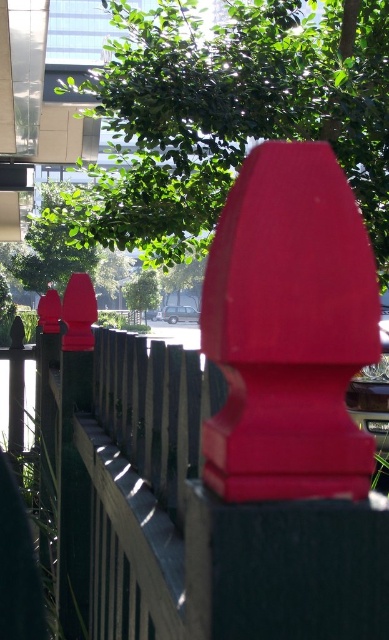
Can you confirm if green leafy tree at upper center is positioned to the left of matte plastic fence post at center?

In fact, green leafy tree at upper center is to the right of matte plastic fence post at center.

Does green leafy tree at upper center lie behind matte plastic fence post at center?

Yes.

Which is behind, point (264, 131) or point (262, 344)?

The point (264, 131) is behind.

Identify the location of green leafy tree at upper center. The image size is (389, 640). (229, 115).

At what (x,y) coordinates should I click in order to perform the action: click on matte wood fence at center. Please return your answer as a coordinate pair (x, y). Looking at the image, I should click on (173, 509).

What do you see at coordinates (173, 509) in the screenshot? I see `matte wood fence at center` at bounding box center [173, 509].

Describe the element at coordinates (173, 509) in the screenshot. I see `matte wood fence at center` at that location.

The height and width of the screenshot is (640, 389). Identify the location of matte wood fence at center. (173, 509).

Which is more to the left, matte wood fence at center or matte plastic fence post at center?

matte wood fence at center

Is matte wood fence at center shorter than matte plastic fence post at center?

Incorrect, matte wood fence at center's height does not fall short of matte plastic fence post at center's.

Does point (110, 588) come closer to viewer compared to point (278, 259)?

No, (110, 588) is further to viewer.

Locate an element on the screen. matte wood fence at center is located at coordinates (173, 509).